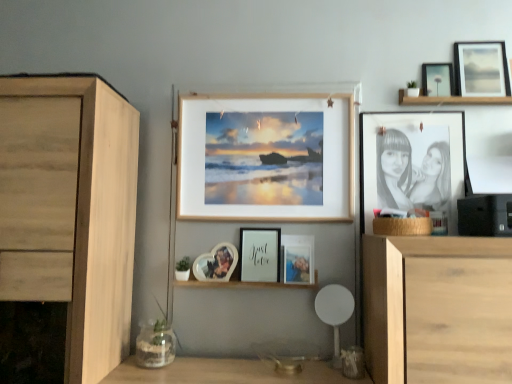
What is the approximate height of clear glass vase at lower left?

It is 17.97 centimeters.

Measure the distance between point [286,243] and camera.

The depth of point [286,243] is 5.66 feet.

What do you see at coordinates (298, 259) in the screenshot?
I see `matte black photo frame at center, which appears as the fourth picture frame when viewed from the right` at bounding box center [298, 259].

Looking at this image, what is the approximate width of matte glass photo frame at center, which appears as the seventh picture frame when viewed from the right?

It is 7.00 centimeters.

In order to face light wood cabinet at left, should I rotate leftwards or rightwards?

It's best to rotate left around 27.969 degrees.

The height and width of the screenshot is (384, 512). I want to click on white plastic chair at lower center, so click(334, 312).

Considering the positions of objects matte black photo frame at center, which appears as the fourth picture frame when viewed from the right, and clear glass vase at lower left in the image provided, who is in front, matte black photo frame at center, which appears as the fourth picture frame when viewed from the right, or clear glass vase at lower left?

clear glass vase at lower left.

Is clear glass vase at lower left at the back of matte black photo frame at center, which appears as the fourth picture frame when viewed from the right?

No, clear glass vase at lower left is not at the back of matte black photo frame at center, which appears as the fourth picture frame when viewed from the right.

Who is shorter, matte black photo frame at center, which appears as the fourth picture frame when viewed from the right, or clear glass vase at lower left?

Standing shorter between the two is matte black photo frame at center, which appears as the fourth picture frame when viewed from the right.

The width and height of the screenshot is (512, 384). In order to click on glass vase in front of the matte black photo frame at center, which appears as the fourth picture frame when viewed from the right in this screenshot , I will do tap(155, 345).

Considering their positions, is wooden frame at center, the fifth picture frame from the right, located in front of or behind matte wooden picture frame at upper right, the 1th picture frame when ordered from right to left?

Visually, wooden frame at center, the fifth picture frame from the right, is located in front of matte wooden picture frame at upper right, the 1th picture frame when ordered from right to left.

From the image's perspective, who appears lower, wooden frame at center, which ranks as the third picture frame in left-to-right order, or matte wooden picture frame at upper right, the 1th picture frame when ordered from right to left?

wooden frame at center, which ranks as the third picture frame in left-to-right order, from the image's perspective.

Locate an element on the screen. The image size is (512, 384). the 2nd picture frame above the wooden frame at center, which ranks as the third picture frame in left-to-right order (from the image's perspective) is located at coordinates (481, 69).

Considering the relative sizes of wooden frame at center, the fifth picture frame from the right, and matte wooden picture frame at upper right, marked as the 7th picture frame in a left-to-right arrangement, in the image provided, is wooden frame at center, the fifth picture frame from the right, thinner than matte wooden picture frame at upper right, marked as the 7th picture frame in a left-to-right arrangement,?

In fact, wooden frame at center, the fifth picture frame from the right, might be wider than matte wooden picture frame at upper right, marked as the 7th picture frame in a left-to-right arrangement.

The image size is (512, 384). In order to click on the 1st picture frame in front of the matte black picture frame at upper right, the 6th picture frame in the left-to-right sequence, starting your count from the anchor in this screenshot , I will do `click(481, 69)`.

Consider the image. Is matte wooden picture frame at upper right, marked as the 7th picture frame in a left-to-right arrangement, next to matte black picture frame at upper right, the 6th picture frame in the left-to-right sequence, and touching it?

No, matte wooden picture frame at upper right, marked as the 7th picture frame in a left-to-right arrangement, is not with matte black picture frame at upper right, the 6th picture frame in the left-to-right sequence.

Which object is more forward, matte wooden picture frame at upper right, the 1th picture frame when ordered from right to left, or matte black picture frame at upper right, the 6th picture frame in the left-to-right sequence?

matte wooden picture frame at upper right, the 1th picture frame when ordered from right to left, is more forward.

Between matte wooden picture frame at upper right, the 1th picture frame when ordered from right to left, and matte black picture frame at upper right, the 6th picture frame in the left-to-right sequence, which one has larger width?

matte black picture frame at upper right, the 6th picture frame in the left-to-right sequence.

Is clear glass vase at lower left not inside wooden frame at center, the fifth picture frame from the right?

Yes, clear glass vase at lower left is located beyond the bounds of wooden frame at center, the fifth picture frame from the right.

From their relative heights in the image, would you say clear glass vase at lower left is taller or shorter than wooden frame at center, which ranks as the third picture frame in left-to-right order?

Considering their sizes, clear glass vase at lower left has less height than wooden frame at center, which ranks as the third picture frame in left-to-right order.

From a real-world perspective, which object stands above the other?

From a 3D spatial view, wooden frame at center, which ranks as the third picture frame in left-to-right order, is above.

Are clear glass vase at lower left and wooden frame at center, which ranks as the third picture frame in left-to-right order, far apart?

No, there isn't a large distance between clear glass vase at lower left and wooden frame at center, which ranks as the third picture frame in left-to-right order.

Is matte black photo frame at center, positioned as the 4th picture frame in left-to-right order, oriented towards light wood cabinet at left?

No, matte black photo frame at center, positioned as the 4th picture frame in left-to-right order, is not aimed at light wood cabinet at left.

Which is farther from the camera, (295, 250) or (40, 113)?

The point (295, 250) is farther.

Can you tell me how much matte black photo frame at center, positioned as the 4th picture frame in left-to-right order, and light wood cabinet at left differ in facing direction?

The facing directions of matte black photo frame at center, positioned as the 4th picture frame in left-to-right order, and light wood cabinet at left are 2.25 degrees apart.

Which of these two, matte black photo frame at center, positioned as the 4th picture frame in left-to-right order, or light wood cabinet at left, is wider?

light wood cabinet at left is wider.

Considering the relative positions of matte black frame at center, which is counted as the 6th picture frame, starting from the right, and clear glass vase at lower left in the image provided, is matte black frame at center, which is counted as the 6th picture frame, starting from the right, to the left or to the right of clear glass vase at lower left?

In the image, matte black frame at center, which is counted as the 6th picture frame, starting from the right, appears on the right side of clear glass vase at lower left.

Between matte black frame at center, the second picture frame in the left-to-right sequence, and clear glass vase at lower left, which one has more height?

matte black frame at center, the second picture frame in the left-to-right sequence, is taller.

Can you confirm if matte black frame at center, which is counted as the 6th picture frame, starting from the right, is thinner than clear glass vase at lower left?

Yes.

Consider the image. Which object is more forward, matte black frame at center, which is counted as the 6th picture frame, starting from the right, or clear glass vase at lower left?

clear glass vase at lower left is closer to the camera.

Is black paper photo frame at right, the 5th picture frame in the left-to-right sequence, inside matte glass photo frame at center, which appears as the seventh picture frame when viewed from the right?

No, black paper photo frame at right, the 5th picture frame in the left-to-right sequence, is not surrounded by matte glass photo frame at center, which appears as the seventh picture frame when viewed from the right.

From the image's perspective, would you say matte glass photo frame at center, which appears as the seventh picture frame when viewed from the right, is shown under black paper photo frame at right, arranged as the third picture frame when viewed from the right?

Correct, matte glass photo frame at center, which appears as the seventh picture frame when viewed from the right, appears lower than black paper photo frame at right, arranged as the third picture frame when viewed from the right, in the image.

Would you say matte glass photo frame at center, which appears as the seventh picture frame when viewed from the right, is a long distance from black paper photo frame at right, the 5th picture frame in the left-to-right sequence?

That's not correct — matte glass photo frame at center, which appears as the seventh picture frame when viewed from the right, is a little close to black paper photo frame at right, the 5th picture frame in the left-to-right sequence.

Does matte glass photo frame at center, which appears as the seventh picture frame when viewed from the right, lie in front of black paper photo frame at right, the 5th picture frame in the left-to-right sequence?

No, the depth of matte glass photo frame at center, which appears as the seventh picture frame when viewed from the right, is greater than that of black paper photo frame at right, the 5th picture frame in the left-to-right sequence.

The height and width of the screenshot is (384, 512). I want to click on glass vase lying on the left of matte black photo frame at center, which appears as the fourth picture frame when viewed from the right, so click(x=155, y=345).

From the image's perspective, starting from the matte wooden picture frame at upper right, marked as the 7th picture frame in a left-to-right arrangement, which picture frame is the 2nd one below? Please provide its 2D coordinates.

[(266, 157)]

Looking at the image, which one is located further to matte black frame at center, the second picture frame in the left-to-right sequence, light wood cabinet at left or matte black picture frame at upper right, the 6th picture frame in the left-to-right sequence?

matte black picture frame at upper right, the 6th picture frame in the left-to-right sequence, is further to matte black frame at center, the second picture frame in the left-to-right sequence.

Based on their spatial positions, is clear glass vase at lower left or matte black frame at center, which is counted as the 6th picture frame, starting from the right, closer to white plastic chair at lower center?

matte black frame at center, which is counted as the 6th picture frame, starting from the right.

Which object lies nearer to the anchor point matte black photo frame at center, which appears as the fourth picture frame when viewed from the right, matte black picture frame at upper right, the 6th picture frame in the left-to-right sequence, or matte black frame at center, the second picture frame in the left-to-right sequence?

matte black frame at center, the second picture frame in the left-to-right sequence.

From the image, which object appears to be farther from matte black frame at center, the second picture frame in the left-to-right sequence, matte black photo frame at center, positioned as the 4th picture frame in left-to-right order, or clear glass vase at lower left?

The object further to matte black frame at center, the second picture frame in the left-to-right sequence, is clear glass vase at lower left.

Which object lies nearer to the anchor point matte black picture frame at upper right, the 6th picture frame in the left-to-right sequence, black paper photo frame at right, arranged as the third picture frame when viewed from the right, or matte black frame at center, the second picture frame in the left-to-right sequence?

black paper photo frame at right, arranged as the third picture frame when viewed from the right.

From the image, which object appears to be nearer to light wood cabinet at left, white plastic chair at lower center or black paper photo frame at right, the 5th picture frame in the left-to-right sequence?

white plastic chair at lower center is closer to light wood cabinet at left.

Which object lies nearer to the anchor point clear glass vase at lower left, white plastic chair at lower center or black paper photo frame at right, arranged as the third picture frame when viewed from the right?

Among the two, white plastic chair at lower center is located nearer to clear glass vase at lower left.

In the scene shown: From the image, which object appears to be nearer to wooden frame at center, which ranks as the third picture frame in left-to-right order, matte black frame at center, which is counted as the 6th picture frame, starting from the right, or matte wooden picture frame at upper right, marked as the 7th picture frame in a left-to-right arrangement?

matte black frame at center, which is counted as the 6th picture frame, starting from the right, is positioned closer to the anchor wooden frame at center, which ranks as the third picture frame in left-to-right order.

The image size is (512, 384). Find the location of `glass vase between light wood cabinet at left and wooden frame at center, the fifth picture frame from the right, from left to right`. glass vase between light wood cabinet at left and wooden frame at center, the fifth picture frame from the right, from left to right is located at coordinates (155, 345).

Where is `glass vase situated between light wood cabinet at left and white plastic chair at lower center from left to right`? This screenshot has width=512, height=384. glass vase situated between light wood cabinet at left and white plastic chair at lower center from left to right is located at coordinates (155, 345).

Find the location of a particular element. The width and height of the screenshot is (512, 384). chair located between clear glass vase at lower left and black paper photo frame at right, arranged as the third picture frame when viewed from the right, in the left-right direction is located at coordinates (334, 312).

Where is `picture frame between clear glass vase at lower left and matte black frame at center, the second picture frame in the left-to-right sequence`? This screenshot has height=384, width=512. picture frame between clear glass vase at lower left and matte black frame at center, the second picture frame in the left-to-right sequence is located at coordinates (216, 263).